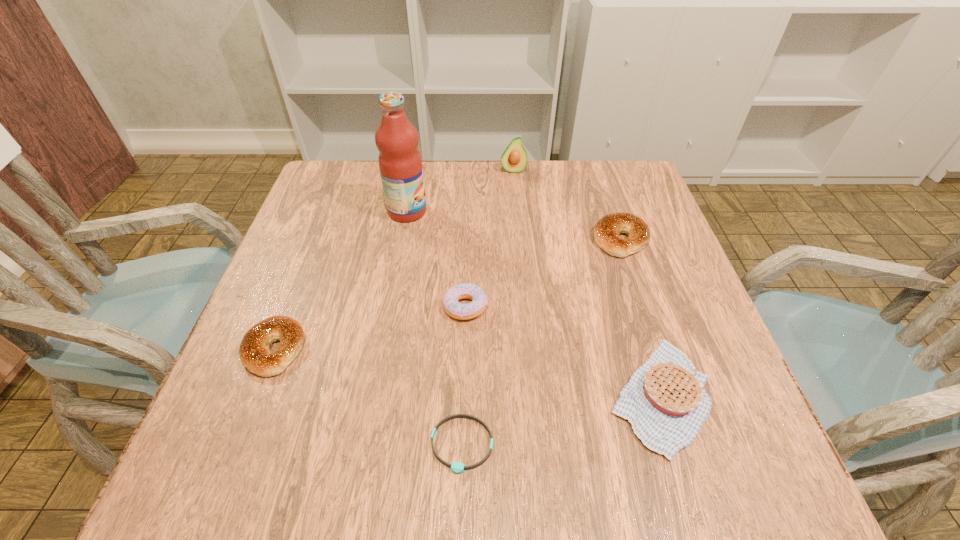
Identify which object is the fourth nearest to the wristband. Please provide its 2D coordinates. Your answer should be formatted as a tuple, i.e. [(x, y)], where the tuple contains the x and y coordinates of a point satisfying the conditions above.

[(606, 231)]

In order to click on vacant space that satisfies the following two spatial constraints: 1. on the front label of the tallest object; 2. on the back side of the farther bagel in this screenshot , I will do `click(402, 239)`.

Locate an element on the screen. The image size is (960, 540). vacant position in the image that satisfies the following two spatial constraints: 1. on the back side of the doughnut; 2. on the left side of the nearer bagel is located at coordinates (291, 307).

Identify the location of vacant region that satisfies the following two spatial constraints: 1. on the back side of the right bagel; 2. on the front label of the fruit juice. (612, 211).

You are a GUI agent. You are given a task and a screenshot of the screen. Output one action in this format:
    pyautogui.click(x=<x>, y=<y>)
    Task: Click on the free location that satisfies the following two spatial constraints: 1. on the cut side of the third object from right to left; 2. on the front label of the tallest object
    
    Given the screenshot: What is the action you would take?
    pyautogui.click(x=516, y=211)